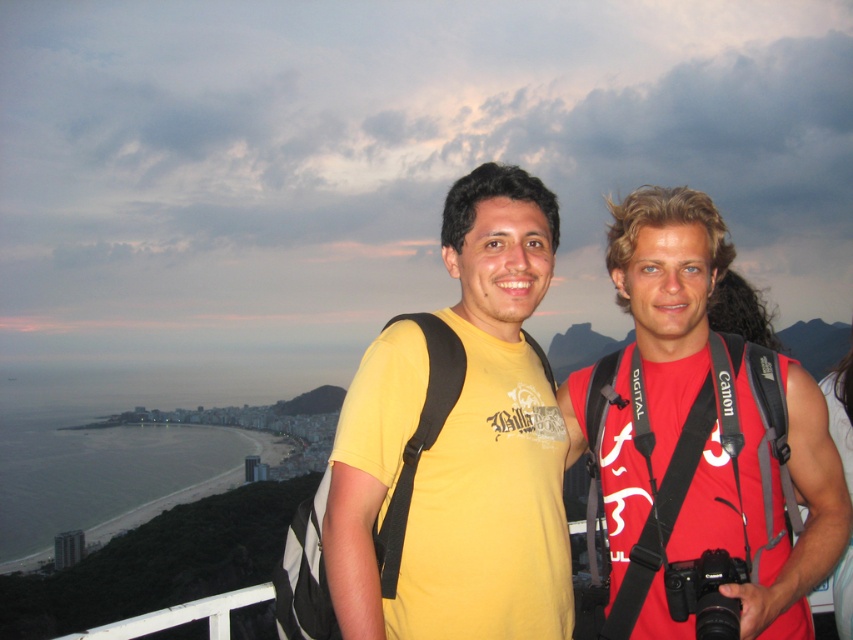
Question: Is yellow matte t-shirt at center to the left of red matte shirt at center from the viewer's perspective?

Choices:
 (A) no
 (B) yes

Answer: (B)

Question: Which of the following is the farthest from the observer?

Choices:
 (A) red matte shirt at center
 (B) black plastic camera at center

Answer: (A)

Question: From the image, what is the correct spatial relationship of red matte shirt at center in relation to black plastic camera at center?

Choices:
 (A) left
 (B) right

Answer: (B)

Question: Which of these objects is positioned farthest from the yellow matte t-shirt at center?

Choices:
 (A) black plastic camera at center
 (B) red matte shirt at center

Answer: (A)

Question: Which of the following is the farthest from the observer?

Choices:
 (A) red matte shirt at center
 (B) yellow matte t-shirt at center

Answer: (B)

Question: Is yellow matte t-shirt at center thinner than black plastic camera at center?

Choices:
 (A) yes
 (B) no

Answer: (B)